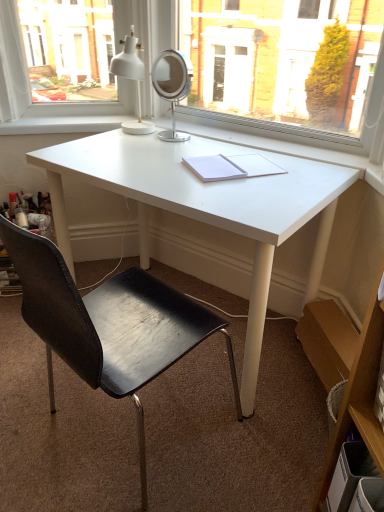
I want to click on vacant location below black leather chair at center (from a real-world perspective), so click(118, 432).